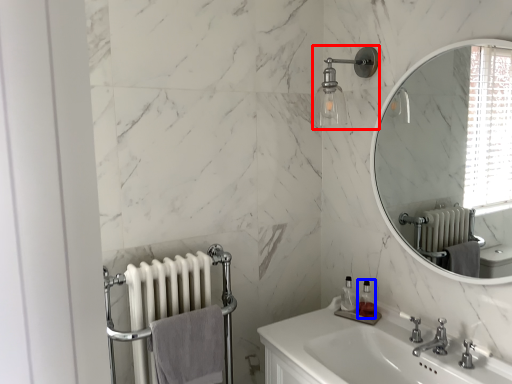
Question: Which of the following is the farthest to the observer, shower (highlighted by a red box) or soap dispenser (highlighted by a blue box)?

Choices:
 (A) shower
 (B) soap dispenser

Answer: (B)